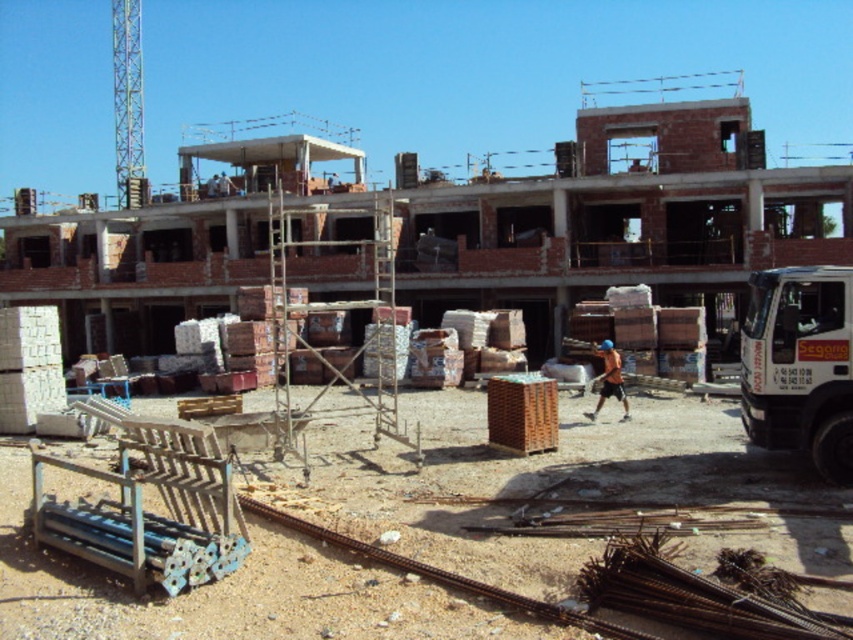
Question: Is black metal train track at lower center closer to camera compared to orange fabric construction worker at center?

Choices:
 (A) yes
 (B) no

Answer: (A)

Question: Among these objects, which one is farthest from the camera?

Choices:
 (A) black metal train track at lower center
 (B) orange fabric construction worker at center

Answer: (B)

Question: Can you confirm if black metal train track at lower center is bigger than orange fabric construction worker at center?

Choices:
 (A) yes
 (B) no

Answer: (A)

Question: Is black metal train track at lower center to the right of orange fabric construction worker at center from the viewer's perspective?

Choices:
 (A) no
 (B) yes

Answer: (A)

Question: Which point is farther to the camera?

Choices:
 (A) (453, 576)
 (B) (608, 392)

Answer: (B)